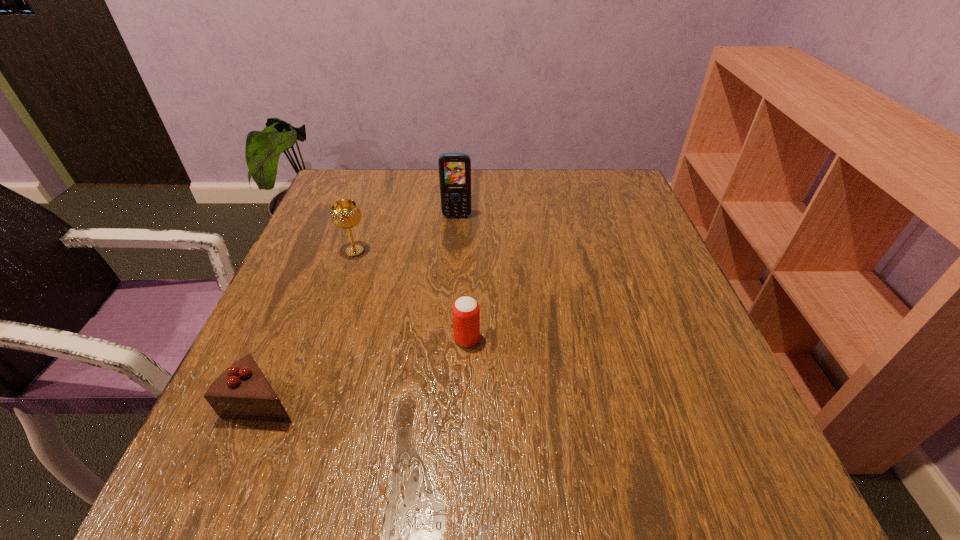
Identify the location of the tallest object. The image size is (960, 540). (454, 168).

Where is `the farthest object`? The image size is (960, 540). the farthest object is located at coordinates (x=454, y=168).

The width and height of the screenshot is (960, 540). I want to click on the third nearest object, so click(x=346, y=213).

I want to click on chalice, so click(346, 213).

Where is `beer can`? The width and height of the screenshot is (960, 540). beer can is located at coordinates (466, 312).

Image resolution: width=960 pixels, height=540 pixels. I want to click on chocolate cake, so click(242, 392).

Find the location of `free space located 0.160m on the screen of the farthest object`. free space located 0.160m on the screen of the farthest object is located at coordinates (454, 261).

At what (x,y) coordinates should I click in order to perform the action: click on vacant area situated on the right of the third nearest object. Please return your answer as a coordinate pair (x, y). This screenshot has width=960, height=540. Looking at the image, I should click on (454, 251).

Image resolution: width=960 pixels, height=540 pixels. Identify the location of vacant space situated 0.230m on the front of the second nearest object. (463, 480).

The width and height of the screenshot is (960, 540). In order to click on free space located on the right of the chocolate cake in this screenshot , I will do coord(474,400).